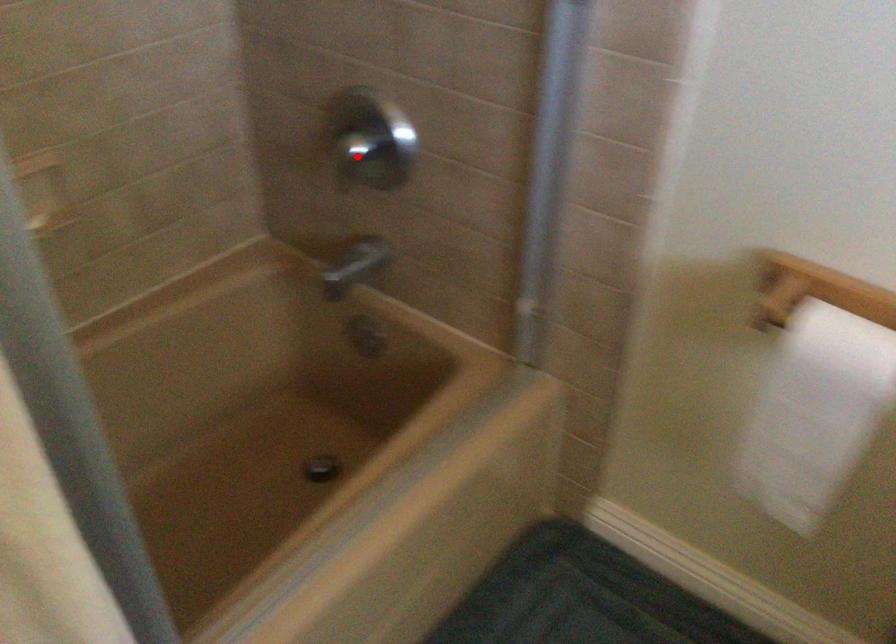
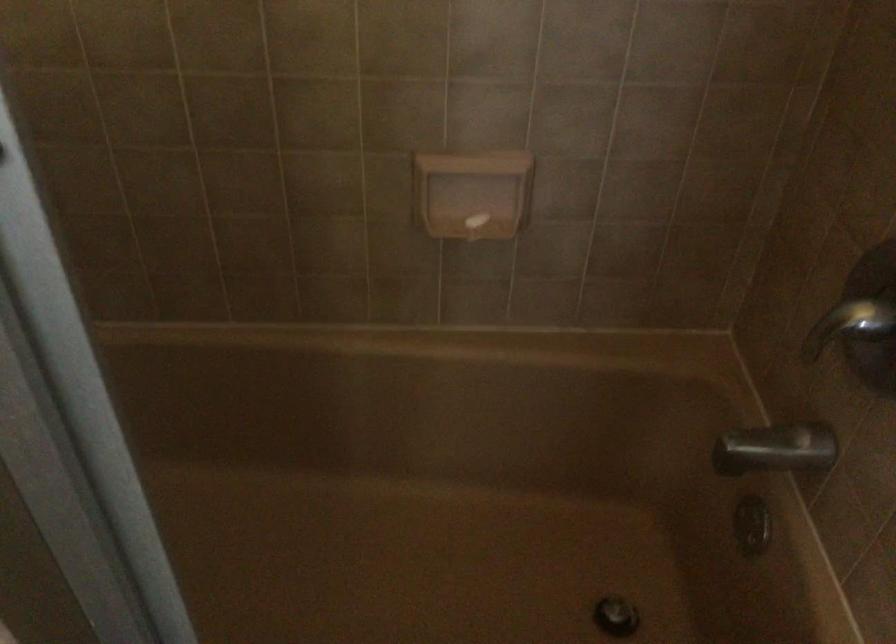
Find the pixel in the second image that matches the highlighted location in the first image.

(849, 325)